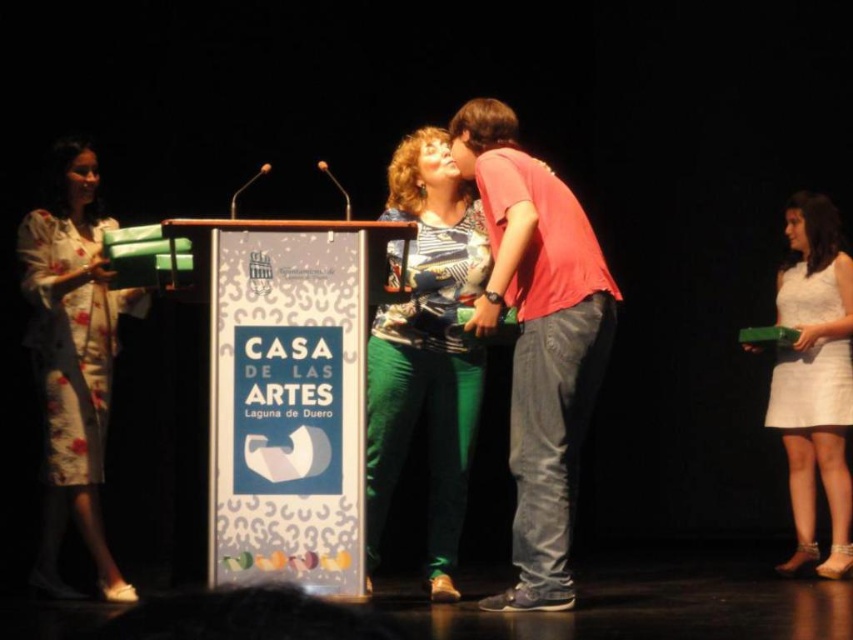
You are an event organizer and need to ensure that the attire of the speakers is visible to the audience. Which item of clothing is positioned higher on the body between the pink cotton shirt at center and the printed fabric blouse at center?

The pink cotton shirt at center is located above the printed fabric blouse at center, so it is positioned higher on the body.

You are an event coordinator at the CASA DE LAS ARTES ceremony. You need to determine the spatial relationship between the printed fabric blouse at center and the white satin dress at lower right. Which object is positioned higher in the image?

The printed fabric blouse at center is taller than the white satin dress at lower right, so the printed fabric blouse at center is positioned higher in the image.